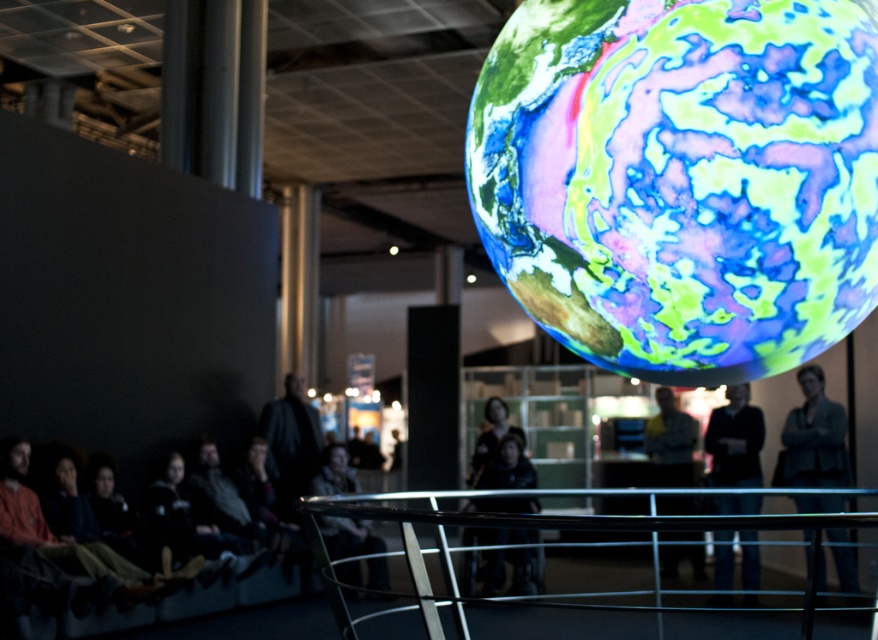
Question: Is matte gray jacket at right behind dark gray jacket at center?

Choices:
 (A) yes
 (B) no

Answer: (B)

Question: Is dark blue sweater at center positioned behind camouflage jacket at center?

Choices:
 (A) no
 (B) yes

Answer: (B)

Question: Which is farther from the dark blue sweater at center?

Choices:
 (A) light brown leather jacket at center
 (B) black leather jacket at center
 (C) translucent glass globe at upper center

Answer: (C)

Question: Which object is the closest to the camouflage jacket at center?

Choices:
 (A) dark blue sweater at center
 (B) dark gray jacket at center
 (C) black leather jacket at center
 (D) matte gray jacket at right

Answer: (B)

Question: Is the position of translucent glass globe at upper center less distant than that of light brown leather jacket at center?

Choices:
 (A) yes
 (B) no

Answer: (A)

Question: Estimate the real-world distances between objects in this image. Which object is farther from the translucent glass globe at upper center?

Choices:
 (A) camouflage jacket at center
 (B) light brown leather jacket at center
 (C) dark blue sweater at center

Answer: (B)